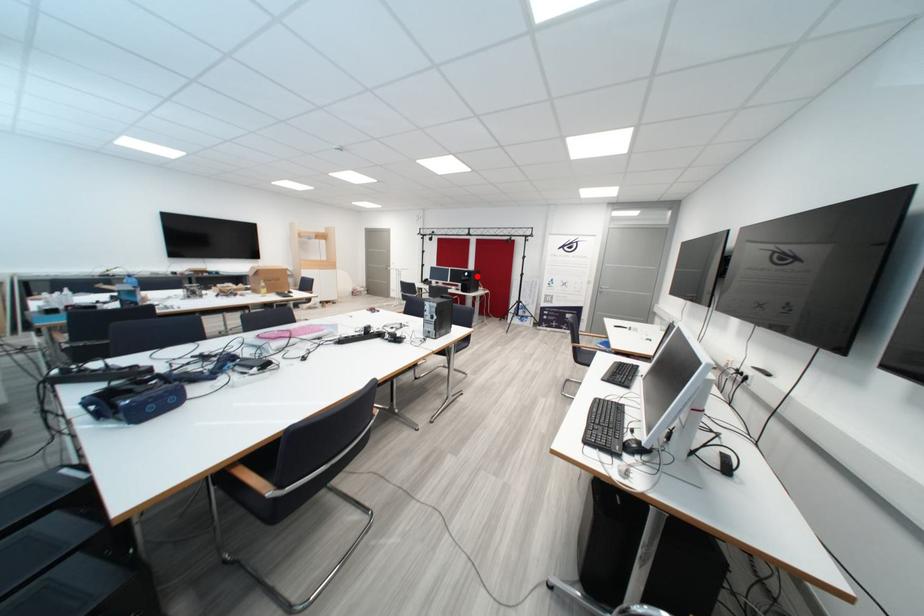
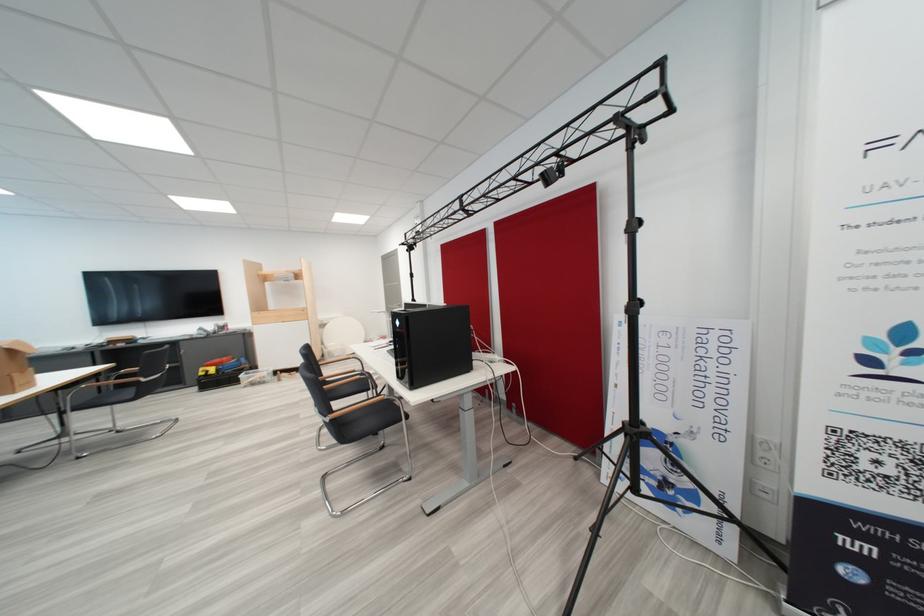
Question: I am providing you with two images of the same scene from different viewpoints. Image1 has a red point marked. In image2, the corresponding 3D location appears at what relative position? Reply with the corresponding letter.

Choices:
 (A) Closer
 (B) Farther

Answer: (B)